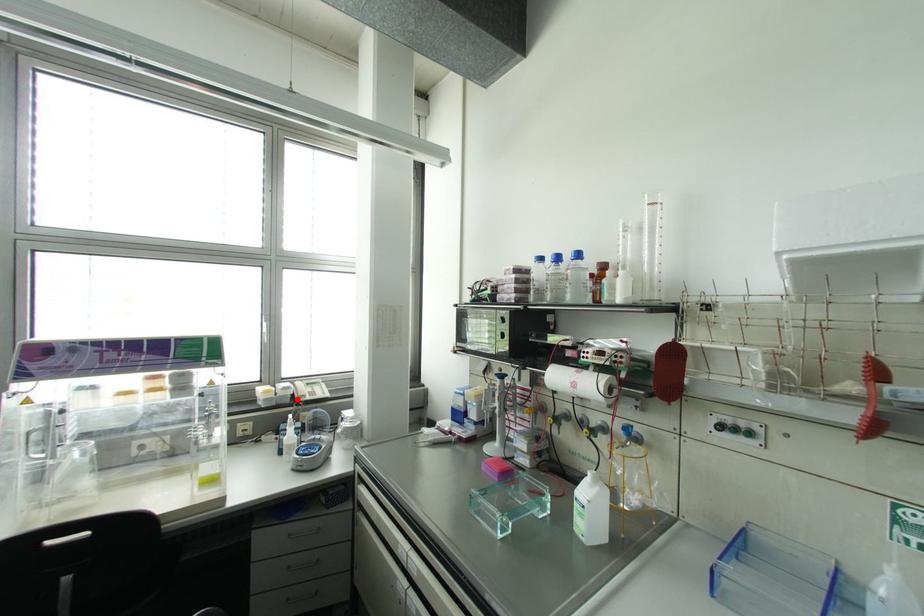
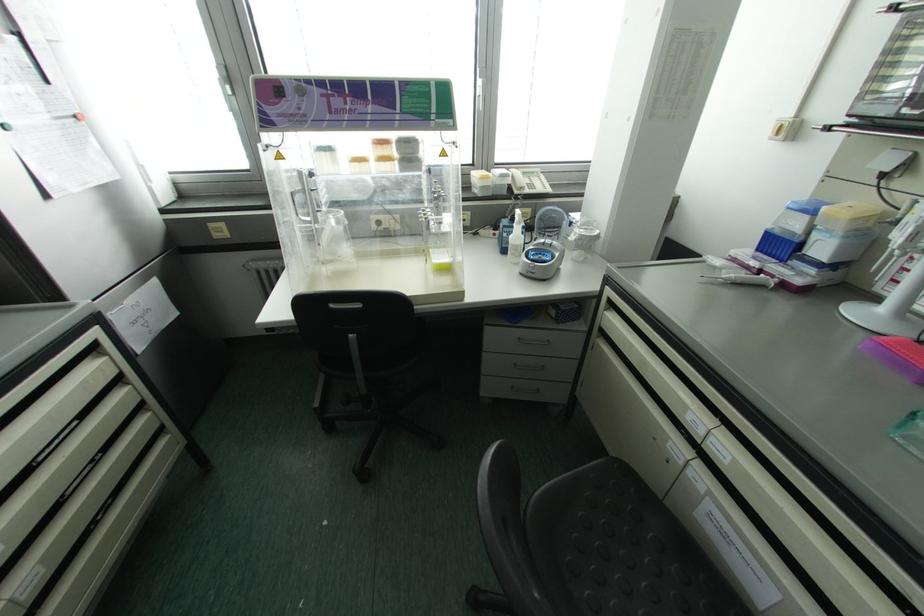
Question: A red point is marked in image1. In image2, is the corresponding 3D point closer to the camera or farther? Reply with the corresponding letter.

Choices:
 (A) The corresponding 3D point is closer.
 (B) The corresponding 3D point is farther.

Answer: (A)